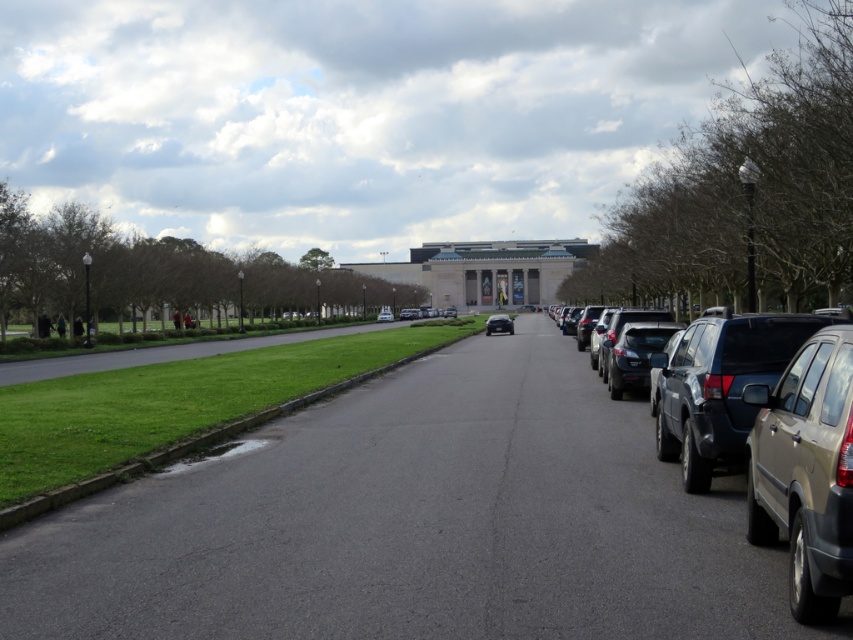
Question: Which point appears farthest from the camera in this image?

Choices:
 (A) (846, 353)
 (B) (381, 314)

Answer: (B)

Question: Among these points, which one is nearest to the camera?

Choices:
 (A) (381, 310)
 (B) (836, 477)

Answer: (B)

Question: Which point is closer to the camera?

Choices:
 (A) (808, 412)
 (B) (498, 321)
 (C) (390, 316)
 (D) (747, 513)

Answer: (A)

Question: Is matte black suv at right bigger than white glossy sedan at center?

Choices:
 (A) no
 (B) yes

Answer: (A)

Question: Is satin black car at center thinner than white glossy sedan at center?

Choices:
 (A) no
 (B) yes

Answer: (B)

Question: Does matte black suv at right come in front of satin black car at center?

Choices:
 (A) no
 (B) yes

Answer: (B)